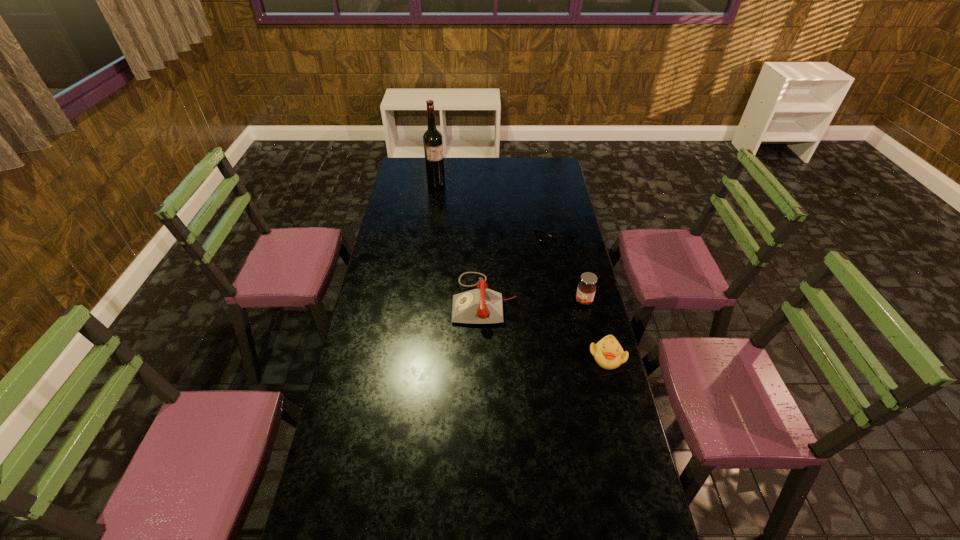
You are a GUI agent. You are given a task and a screenshot of the screen. Output one action in this format:
    pyautogui.click(x=<x>, y=<y>)
    Task: Click on the object located in the far edge section of the desktop
    The height and width of the screenshot is (540, 960).
    Given the screenshot: What is the action you would take?
    pyautogui.click(x=432, y=139)

Locate an element on the screen. The height and width of the screenshot is (540, 960). duckling located at the right edge is located at coordinates tap(608, 353).

I want to click on spectacles at the right edge, so click(541, 236).

The width and height of the screenshot is (960, 540). What are the coordinates of `jam situated at the right edge` in the screenshot? It's located at (586, 289).

Find the location of a particular element. vacant space at the far edge of the desktop is located at coordinates (453, 174).

Image resolution: width=960 pixels, height=540 pixels. In order to click on blank space at the near edge in this screenshot , I will do `click(467, 517)`.

You are a GUI agent. You are given a task and a screenshot of the screen. Output one action in this format:
    pyautogui.click(x=<x>, y=<y>)
    Task: Click on the vacant space at the left edge of the desktop
    The height and width of the screenshot is (540, 960).
    Given the screenshot: What is the action you would take?
    pyautogui.click(x=417, y=209)

In order to click on vacant space at the right edge of the desktop in this screenshot , I will do point(569,260).

The height and width of the screenshot is (540, 960). Identify the location of vacant space at the far left corner. (405, 159).

The image size is (960, 540). What are the coordinates of `vacant space at the far right corner` in the screenshot? It's located at (546, 167).